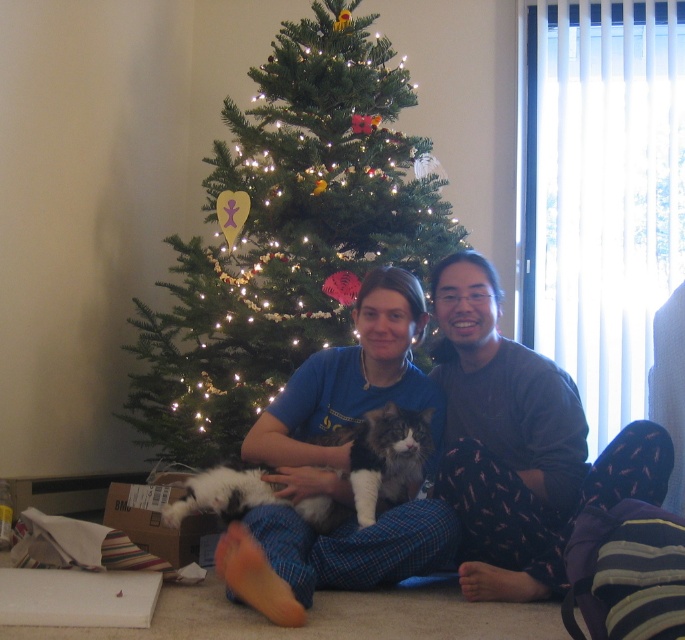
Where is `green matte christmas tree at center`? The width and height of the screenshot is (685, 640). green matte christmas tree at center is located at coordinates (286, 236).

Which is above, green matte christmas tree at center or blue cotton shirt at center?

green matte christmas tree at center

Does point (164, 406) lie behind point (290, 448)?

That is True.

Find the location of a particular element. The height and width of the screenshot is (640, 685). green matte christmas tree at center is located at coordinates (286, 236).

Who is lower down, dark gray fleece pants at center or fluffy white cat at center?

fluffy white cat at center is below.

The width and height of the screenshot is (685, 640). What are the coordinates of `dark gray fleece pants at center` in the screenshot? It's located at (521, 444).

Is blue cotton shirt at center positioned in front of fluffy white cat at center?

That is True.

Does blue cotton shirt at center appear on the left side of fluffy white cat at center?

Incorrect, blue cotton shirt at center is not on the left side of fluffy white cat at center.

Does point (288, 595) come closer to viewer compared to point (397, 476)?

Yes, it is.

Find the location of `blue cotton shirt at center`. blue cotton shirt at center is located at coordinates (347, 392).